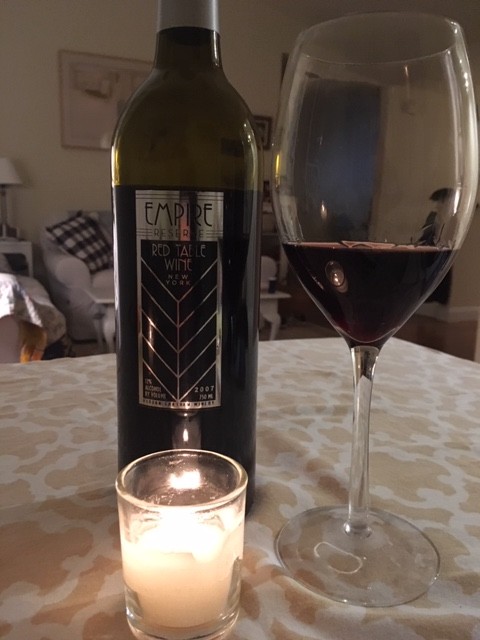
I want to click on walls, so coord(49,182), coord(466,276).